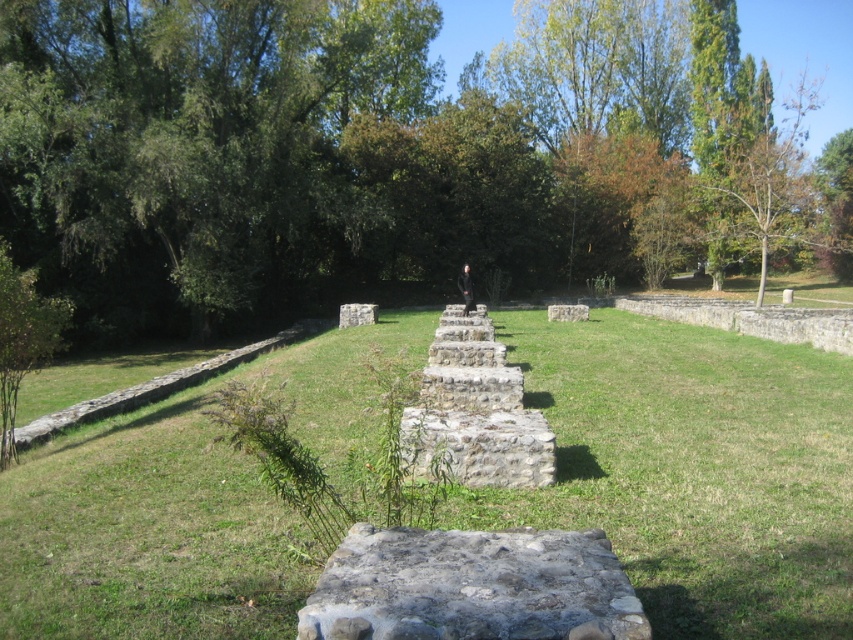
You are standing at the edge of a grassy area with ancient stone ruins. You see the green grassy at center and the rusty stone at center. Which object is closer to you?

The green grassy at center is closer to you because it is further to the viewer than the rusty stone at center.

You are planning to plant a new tree in the green grassy at center area. The recommended planting distance between trees is at least 30 meters to ensure proper growth. Based on the scene, is the existing green leafy tree at center too close to the proposed planting area?

The distance between the green leafy tree at center and the green grassy at center is 30.24 meters, which meets the recommended planting distance of at least 30 meters. Therefore, the existing tree is not too close to the proposed planting area.